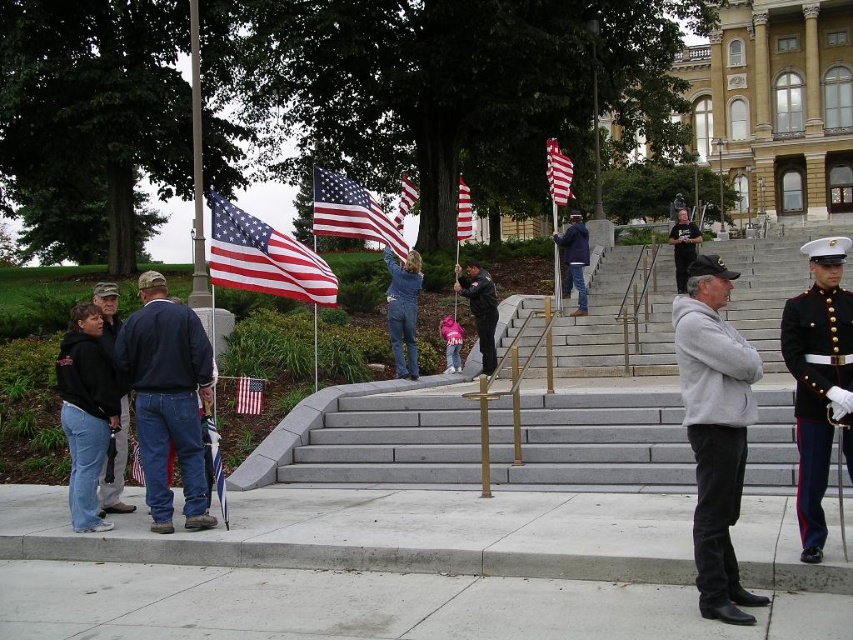
Question: Is shiny dark blue uniform at right below red-white striped flag at upper center?

Choices:
 (A) no
 (B) yes

Answer: (B)

Question: Considering the real-world distances, which object is closest to the metallic flag pole at center?

Choices:
 (A) black leather uniform at center
 (B) black fleece hoodie at lower left

Answer: (B)

Question: Among these objects, which one is farthest from the camera?

Choices:
 (A) shiny dark blue uniform at right
 (B) denim jacket at lower left
 (C) dark blue uniform at center
 (D) blue denim jacket at upper center

Answer: (D)

Question: From the image, what is the correct spatial relationship of metallic flag pole at center in relation to blue denim jacket at upper center?

Choices:
 (A) above
 (B) below

Answer: (A)

Question: Which of the following is the farthest from the observer?

Choices:
 (A) matte fabric flag at center
 (B) black cotton hoodie at lower left
 (C) black fleece hoodie at lower left
 (D) matte american flag at upper center

Answer: (D)

Question: Is blue denim jacket at upper center closer to the viewer compared to black leather uniform at center?

Choices:
 (A) no
 (B) yes

Answer: (B)